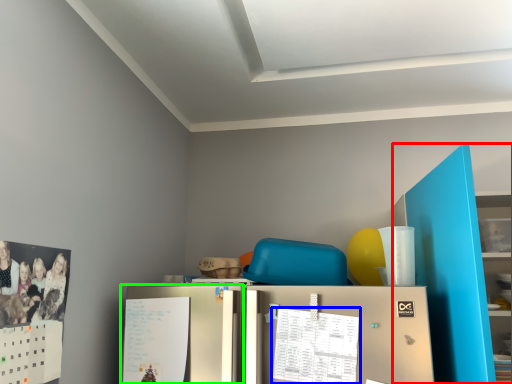
Question: Which object is the farthest from bookshelf (highlighted by a red box)? Choose among these: calendar (highlighted by a blue box) or fridge (highlighted by a green box).

Choices:
 (A) calendar
 (B) fridge

Answer: (B)